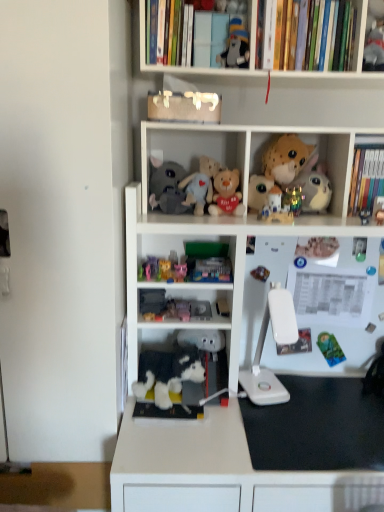
Describe the element at coordinates (260, 273) in the screenshot. I see `shiny metallic ring at center, the ninth toy when ordered from top to bottom` at that location.

How much space does matte plastic toy at lower center, which is the 6th toy in top-to-bottom order, occupy vertically?

matte plastic toy at lower center, which is the 6th toy in top-to-bottom order, is 7.07 centimeters in height.

What do you see at coordinates (150, 268) in the screenshot? I see `matte plastic toy at lower center, placed as the 6th toy when sorted from bottom to top` at bounding box center [150, 268].

The image size is (384, 512). In order to click on white plastic lamp at lower right in this screenshot , I will do `click(277, 343)`.

At what (x,y) coordinates should I click in order to perform the action: click on metallic gold ornament at upper center, placed as the fifth toy when sorted from top to bottom. Please return your answer as a coordinate pair (x, y). The width and height of the screenshot is (384, 512). Looking at the image, I should click on (293, 199).

Is white plastic lamp at lower right a part of shiny metallic ring at center, the ninth toy when ordered from top to bottom?

Actually, white plastic lamp at lower right is outside shiny metallic ring at center, the ninth toy when ordered from top to bottom.

From a real-world perspective, is shiny metallic ring at center, the ninth toy when ordered from top to bottom, above or below white plastic lamp at lower right?

From a real-world perspective, shiny metallic ring at center, the ninth toy when ordered from top to bottom, is physically above white plastic lamp at lower right.

Can you confirm if shiny metallic ring at center, the 3th toy positioned from the bottom, is thinner than white plastic lamp at lower right?

Yes.

Does shiny metallic ring at center, the 3th toy positioned from the bottom, have a smaller size compared to white plastic lamp at lower right?

Indeed, shiny metallic ring at center, the 3th toy positioned from the bottom, has a smaller size compared to white plastic lamp at lower right.

Considering the relative positions of hardcover books at upper center and matte black plush at upper center, arranged as the first toy when viewed from the top, in the image provided, is hardcover books at upper center to the right of matte black plush at upper center, arranged as the first toy when viewed from the top, from the viewer's perspective?

Yes, hardcover books at upper center is to the right of matte black plush at upper center, arranged as the first toy when viewed from the top.

In the scene shown: Is hardcover books at upper center in front of matte black plush at upper center, which ranks as the eleventh toy in bottom-to-top order?

Yes, it is in front of matte black plush at upper center, which ranks as the eleventh toy in bottom-to-top order.

From a real-world perspective, does hardcover books at upper center stand above matte black plush at upper center, which ranks as the eleventh toy in bottom-to-top order?

Indeed, from a real-world perspective, hardcover books at upper center stands above matte black plush at upper center, which ranks as the eleventh toy in bottom-to-top order.

Which of these two, white plastic bookcase at center or hardcover book at upper right, positioned as the first book in bottom-to-top order, stands shorter?

hardcover book at upper right, positioned as the first book in bottom-to-top order, is shorter.

Could you tell me if white plastic bookcase at center is turned towards hardcover book at upper right, acting as the first book starting from the right?

No, white plastic bookcase at center does not turn towards hardcover book at upper right, acting as the first book starting from the right.

What's the angular difference between white plastic bookcase at center and hardcover book at upper right, positioned as the first book in bottom-to-top order,'s facing directions?

They differ by 0.205 degrees in their facing directions.

Consider the image. Which of these two, white plastic bookcase at center or hardcover book at upper right, positioned as the first book in bottom-to-top order, is thinner?

hardcover book at upper right, positioned as the first book in bottom-to-top order.

Which object is closer to the camera taking this photo, green plastic toy at lower right, the tenth toy viewed from the top, or matte black plush at upper center, arranged as the first toy when viewed from the top?

Positioned in front is matte black plush at upper center, arranged as the first toy when viewed from the top.

From the image's perspective, starting from the green plastic toy at lower right, the second toy when ordered from bottom to top, which toy is the 9th one above? Please provide its 2D coordinates.

[(236, 46)]

From the picture: Is green plastic toy at lower right, the second toy when ordered from bottom to top, directly adjacent to matte black plush at upper center, arranged as the first toy when viewed from the top?

No, green plastic toy at lower right, the second toy when ordered from bottom to top, is not making contact with matte black plush at upper center, arranged as the first toy when viewed from the top.

Which is correct: green plastic toy at lower right, the tenth toy viewed from the top, is inside matte black plush at upper center, arranged as the first toy when viewed from the top, or outside of it?

The correct answer is: outside.

Could you tell me if hardcover books at upper center is facing metallic gold ornament at upper center, placed as the fifth toy when sorted from top to bottom?

No.

Are hardcover books at upper center and metallic gold ornament at upper center, the seventh toy in the bottom-to-top sequence, beside each other?

hardcover books at upper center and metallic gold ornament at upper center, the seventh toy in the bottom-to-top sequence, are clearly separated.

Would you say metallic gold ornament at upper center, placed as the fifth toy when sorted from top to bottom, is part of hardcover books at upper center's contents?

Actually, metallic gold ornament at upper center, placed as the fifth toy when sorted from top to bottom, is outside hardcover books at upper center.

How different are the orientations of hardcover books at upper center and metallic gold ornament at upper center, placed as the fifth toy when sorted from top to bottom, in degrees?

hardcover books at upper center and metallic gold ornament at upper center, placed as the fifth toy when sorted from top to bottom, are facing 0.23 degrees away from each other.

Which is in front, plush yellow bear at center, placed as the 5th toy when sorted from bottom to top, or white plush toy at center, which appears as the 1th toy when ordered from the bottom?

white plush toy at center, which appears as the 1th toy when ordered from the bottom.

From a real-world perspective, is plush yellow bear at center, which ranks as the 7th toy in top-to-bottom order, physically above white plush toy at center, which ranks as the eleventh toy in top-to-bottom order?

Yes.

Which object is thinner, plush yellow bear at center, placed as the 5th toy when sorted from bottom to top, or white plush toy at center, which appears as the 1th toy when ordered from the bottom?

plush yellow bear at center, placed as the 5th toy when sorted from bottom to top, is thinner.

Considering the sizes of objects fluffy gray plush at center, which ranks as the 9th toy in bottom-to-top order, and white plush toy at center, which ranks as the eleventh toy in top-to-bottom order, in the image provided, who is bigger, fluffy gray plush at center, which ranks as the 9th toy in bottom-to-top order, or white plush toy at center, which ranks as the eleventh toy in top-to-bottom order,?

white plush toy at center, which ranks as the eleventh toy in top-to-bottom order, is bigger.

Does fluffy gray plush at center, arranged as the 3th toy when viewed from the top, turn towards white plush toy at center, which ranks as the eleventh toy in top-to-bottom order?

No, fluffy gray plush at center, arranged as the 3th toy when viewed from the top, does not turn towards white plush toy at center, which ranks as the eleventh toy in top-to-bottom order.

From the picture: Is fluffy gray plush at center, which ranks as the 9th toy in bottom-to-top order, further to camera compared to white plush toy at center, which ranks as the eleventh toy in top-to-bottom order?

Yes.

This screenshot has height=512, width=384. Find the location of `toy that is the 1st object to the right of the fluffy gray plush at center, which ranks as the 9th toy in bottom-to-top order, starting at the anchor`. toy that is the 1st object to the right of the fluffy gray plush at center, which ranks as the 9th toy in bottom-to-top order, starting at the anchor is located at coordinates (167, 373).

From the image's perspective, count 1st toys upward from the white plastic lamp at lower right and point to it. Please provide its 2D coordinates.

[(260, 273)]

You are a GUI agent. You are given a task and a screenshot of the screen. Output one action in this format:
    pyautogui.click(x=<x>, y=<y>)
    Task: Click on the shelf that is above the matte black plush at upper center, which ranks as the eleventh toy in bottom-to-top order (from a real-world perspective)
    This screenshot has height=512, width=384.
    Given the screenshot: What is the action you would take?
    pyautogui.click(x=337, y=36)

Considering their positions, is matte black plush at upper center, arranged as the first toy when viewed from the top, positioned further to soft plush toy at upper right, which is the 1th cabinet from right to left, than metallic gold ornament at upper center, the seventh toy in the bottom-to-top sequence?

The object further to soft plush toy at upper right, which is the 1th cabinet from right to left, is matte black plush at upper center, arranged as the first toy when viewed from the top.

Which object lies nearer to the anchor point pink plush toy at center, the fourth toy ordered from the bottom, fluffy fabric stuffed animals at center, positioned as the 1th cabinet in left-to-right order, or matte plastic toy at lower center, which is the 6th toy in top-to-bottom order?

matte plastic toy at lower center, which is the 6th toy in top-to-bottom order, lies closer to pink plush toy at center, the fourth toy ordered from the bottom, than the other object.

Considering their positions, is matte plastic toy at lower center, placed as the 6th toy when sorted from bottom to top, positioned further to white plastic lamp at lower right than metallic gold ornament at upper center, the seventh toy in the bottom-to-top sequence?

metallic gold ornament at upper center, the seventh toy in the bottom-to-top sequence, lies further to white plastic lamp at lower right than the other object.

When comparing their distances from fluffy beige teddy bear at center, the eighth toy positioned from the bottom, does hardcover books at upper center or metallic gold ornament at upper center, the seventh toy in the bottom-to-top sequence, seem closer?

Among the two, metallic gold ornament at upper center, the seventh toy in the bottom-to-top sequence, is located nearer to fluffy beige teddy bear at center, the eighth toy positioned from the bottom.

Based on their spatial positions, is white plastic lamp at lower right or hardcover book at upper right, positioned as the first book in bottom-to-top order, closer to fluffy fabric stuffed animals at center, the 2th cabinet when ordered from right to left?

Based on the image, white plastic lamp at lower right appears to be nearer to fluffy fabric stuffed animals at center, the 2th cabinet when ordered from right to left.

When comparing their distances from white plastic bookcase at center, does shiny metallic ring at center, the 3th toy positioned from the bottom, or hardcover books at upper center seem closer?

Among the two, hardcover books at upper center is located nearer to white plastic bookcase at center.

When comparing their distances from plush yellow bear at center, which ranks as the 7th toy in top-to-bottom order, does spotted plush toy at upper right, the 10th toy when ordered from bottom to top, or metallic gold ornament at upper center, the seventh toy in the bottom-to-top sequence, seem further?

spotted plush toy at upper right, the 10th toy when ordered from bottom to top, is positioned further to the anchor plush yellow bear at center, which ranks as the 7th toy in top-to-bottom order.

Looking at the image, which one is located further to plush yellow bear at center, placed as the 5th toy when sorted from bottom to top, matte plastic toy at lower center, which is the 6th toy in top-to-bottom order, or hardcover books at upper center?

Among the two, hardcover books at upper center is located further to plush yellow bear at center, placed as the 5th toy when sorted from bottom to top.

Identify the location of book that lies between spotted plush toy at upper right, the 10th toy when ordered from bottom to top, and shiny metallic ring at center, the ninth toy when ordered from top to bottom, from top to bottom. The height and width of the screenshot is (512, 384). (366, 179).

This screenshot has height=512, width=384. I want to click on equipment between fluffy gray plush at center, which ranks as the 9th toy in bottom-to-top order, and white plastic bookcase at center from top to bottom, so point(277,343).

Locate an element on the screen. cabinet between fluffy gray plush at center, arranged as the 3th toy when viewed from the top, and fluffy beige teddy bear at center, which ranks as the 4th toy in top-to-bottom order, in the horizontal direction is located at coordinates (198, 179).

Find the location of a particular element. This screenshot has width=384, height=512. cabinet between hardcover book at upper right, acting as the first book starting from the right, and green plastic toy at lower right, the second toy when ordered from bottom to top, from top to bottom is located at coordinates (198, 179).